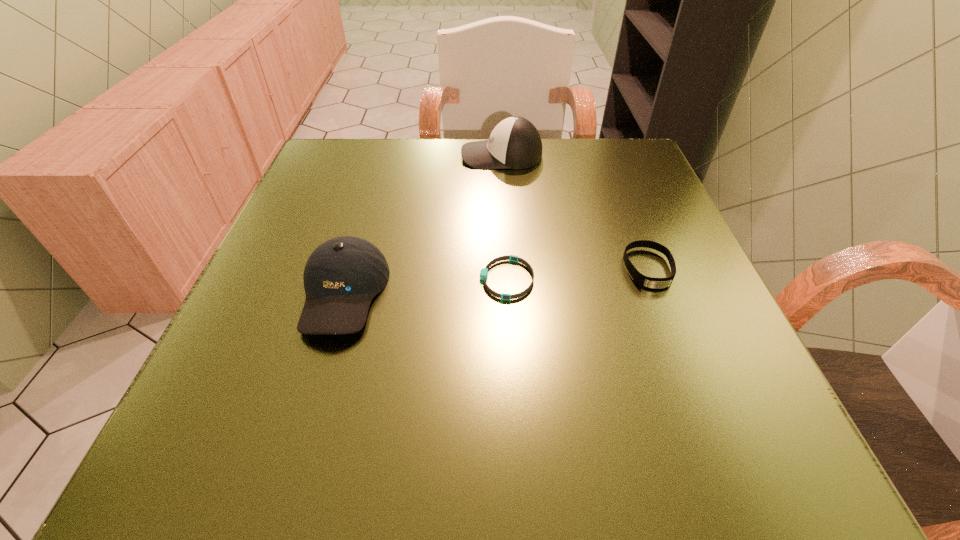
Where is `free region at the near edge of the desktop`? free region at the near edge of the desktop is located at coordinates (375, 480).

Identify the location of free space at the left edge of the desktop. The width and height of the screenshot is (960, 540). (284, 299).

At what (x,y) coordinates should I click in order to perform the action: click on free space at the right edge of the desktop. Please return your answer as a coordinate pair (x, y). The width and height of the screenshot is (960, 540). Looking at the image, I should click on (679, 235).

Locate an element on the screen. vacant space at the far right corner is located at coordinates coord(644,167).

Where is `blank area at the near right corner`? blank area at the near right corner is located at coordinates (657, 429).

The height and width of the screenshot is (540, 960). Identify the location of blank region between the right wristband and the baseball cap. (495, 281).

What are the coordinates of `empty space that is in between the cap and the second tallest object` in the screenshot? It's located at (422, 224).

In order to click on empty location between the leftmost object and the shortest object in this screenshot , I will do `click(425, 286)`.

Find the location of `free area in between the shortest object and the taller wristband`. free area in between the shortest object and the taller wristband is located at coordinates (578, 274).

Identify the location of vacant space that is in between the farthest object and the shorter wristband. This screenshot has width=960, height=540. (504, 217).